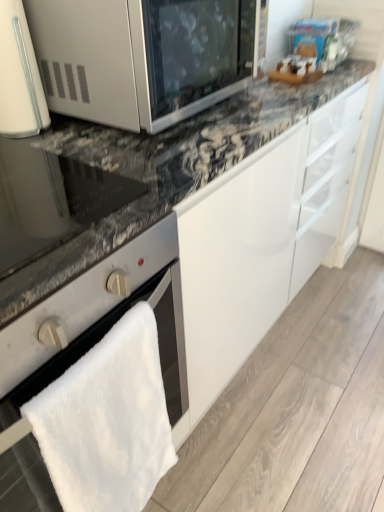
Question: Does matte black oven at left have a smaller size compared to satin silver microwave at upper left?

Choices:
 (A) no
 (B) yes

Answer: (B)

Question: Is matte black oven at left facing away from satin silver microwave at upper left?

Choices:
 (A) no
 (B) yes

Answer: (A)

Question: Is matte black oven at left positioned before satin silver microwave at upper left?

Choices:
 (A) no
 (B) yes

Answer: (B)

Question: From the image's perspective, would you say matte black oven at left is shown under satin silver microwave at upper left?

Choices:
 (A) yes
 (B) no

Answer: (A)

Question: Is matte black oven at left at the left side of satin silver microwave at upper left?

Choices:
 (A) no
 (B) yes

Answer: (B)

Question: Relative to satin silver microwave at upper left, is satin silver oven at lower left in front or behind?

Choices:
 (A) behind
 (B) front

Answer: (B)

Question: In terms of height, does satin silver oven at lower left look taller or shorter compared to satin silver microwave at upper left?

Choices:
 (A) tall
 (B) short

Answer: (A)

Question: From a real-world perspective, is satin silver oven at lower left physically located above or below satin silver microwave at upper left?

Choices:
 (A) below
 (B) above

Answer: (A)

Question: Is satin silver oven at lower left situated inside satin silver microwave at upper left or outside?

Choices:
 (A) inside
 (B) outside

Answer: (B)

Question: Considering the positions of satin silver microwave at upper left and matte black oven at left in the image, is satin silver microwave at upper left taller or shorter than matte black oven at left?

Choices:
 (A) short
 (B) tall

Answer: (B)

Question: In the image, is satin silver microwave at upper left positioned in front of or behind matte black oven at left?

Choices:
 (A) front
 (B) behind

Answer: (B)

Question: Looking at the image, does satin silver microwave at upper left seem bigger or smaller compared to matte black oven at left?

Choices:
 (A) big
 (B) small

Answer: (A)

Question: Looking at their shapes, would you say satin silver microwave at upper left is wider or thinner than matte black oven at left?

Choices:
 (A) wide
 (B) thin

Answer: (B)

Question: In the image, is satin silver microwave at upper left positioned in front of or behind satin silver oven at lower left?

Choices:
 (A) behind
 (B) front

Answer: (A)

Question: Is point (112, 94) closer or farther from the camera than point (170, 250)?

Choices:
 (A) closer
 (B) farther

Answer: (B)